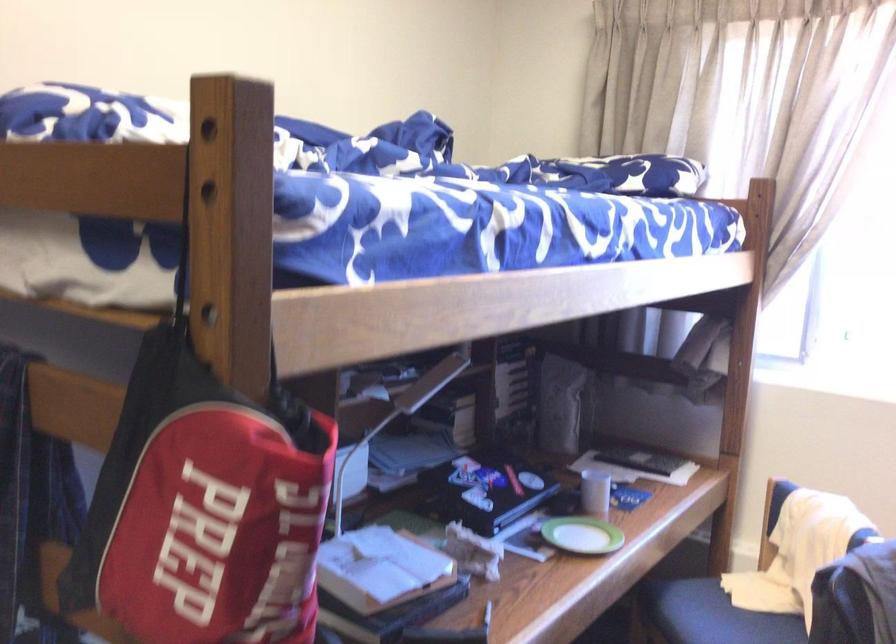
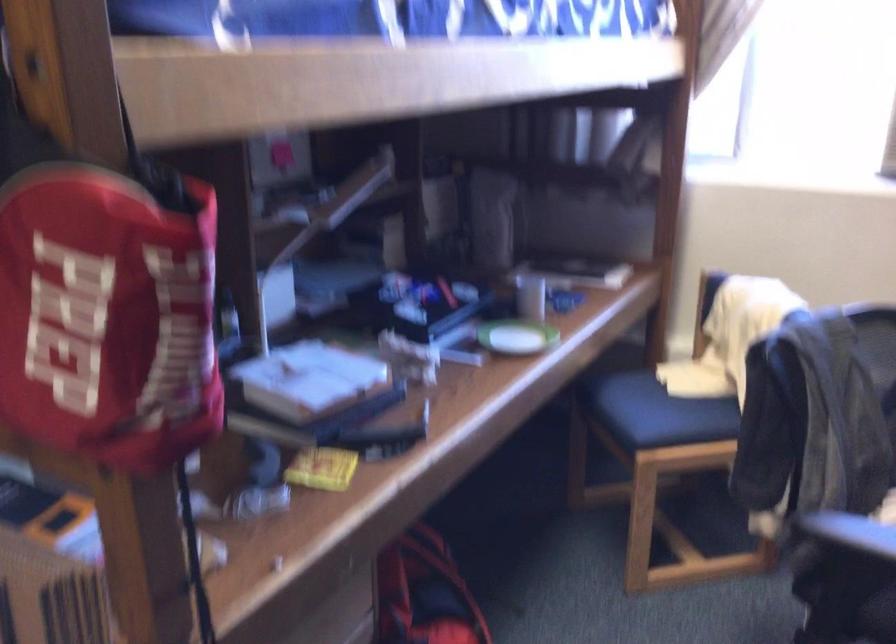
Question: I am providing you with two images of the same scene from different viewpoints. Please identify which objects are invisible in image2.

Choices:
 (A) white covered book
 (B) small green saucer
 (C) chair sitting surface
 (D) none of these

Answer: (D)